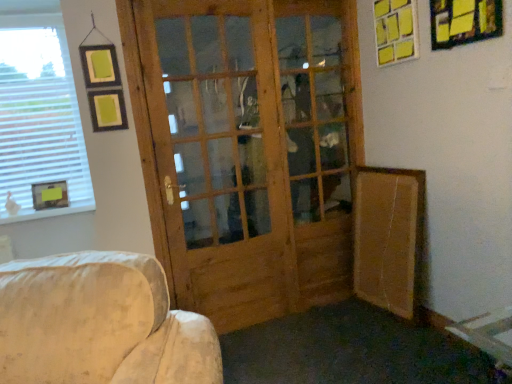
Where is `yellow paper picture frame at upper right, placed as the second picture frame when sorted from right to left`? The image size is (512, 384). yellow paper picture frame at upper right, placed as the second picture frame when sorted from right to left is located at coordinates (395, 31).

This screenshot has height=384, width=512. What do you see at coordinates (50, 195) in the screenshot?
I see `wooden picture frame at left, which ranks as the 3th picture frame in right-to-left order` at bounding box center [50, 195].

The width and height of the screenshot is (512, 384). In order to click on wooden picture frame at left, the first picture frame positioned from the bottom in this screenshot , I will do `click(50, 195)`.

Based on the photo, what is the approximate width of white blinds at left?

1.01 inches.

Where is `yellow paper picture frame at upper right, marked as the 2th picture frame in a front-to-back arrangement`? yellow paper picture frame at upper right, marked as the 2th picture frame in a front-to-back arrangement is located at coordinates (395, 31).

From the image's perspective, is yellow paper picture frame at upper right, acting as the second picture frame starting from the back, positioned above or below brown cardboard at lower right?

yellow paper picture frame at upper right, acting as the second picture frame starting from the back, is above brown cardboard at lower right.

Based on the photo, considering the relative sizes of yellow paper picture frame at upper right, placed as the 3th picture frame when sorted from bottom to top, and brown cardboard at lower right in the image provided, is yellow paper picture frame at upper right, placed as the 3th picture frame when sorted from bottom to top, shorter than brown cardboard at lower right?

Indeed, yellow paper picture frame at upper right, placed as the 3th picture frame when sorted from bottom to top, has a lesser height compared to brown cardboard at lower right.

From the image's perspective, would you say natural wood screen door at center is shown under white blinds at left?

Yes, from the image's perspective, natural wood screen door at center is below white blinds at left.

Are natural wood screen door at center and white blinds at left making contact?

No, natural wood screen door at center is not making contact with white blinds at left.

From a real-world perspective, is natural wood screen door at center physically located above or below white blinds at left?

Clearly, from a real-world perspective, natural wood screen door at center is below white blinds at left.

Between point (174, 239) and point (64, 88), which one is positioned in front?

The point (174, 239) is closer to the camera.

What's the angular difference between natural wood screen door at center and wooden picture frame at left, which ranks as the 3th picture frame in right-to-left order,'s facing directions?

There is a 7.81-degree angle between the facing directions of natural wood screen door at center and wooden picture frame at left, which ranks as the 3th picture frame in right-to-left order.

From the image's perspective, is natural wood screen door at center above or below wooden picture frame at left, the first picture frame positioned from the bottom?

natural wood screen door at center is above wooden picture frame at left, the first picture frame positioned from the bottom.

Can you confirm if natural wood screen door at center is smaller than wooden picture frame at left, which appears as the 3th picture frame when viewed from the top?

No.

Looking at this image, does natural wood screen door at center appear on the left side of wooden picture frame at left, arranged as the 1th picture frame when viewed from the back?

In fact, natural wood screen door at center is to the right of wooden picture frame at left, arranged as the 1th picture frame when viewed from the back.

From a real-world perspective, is yellow paper picture frame at upper right, the 1th picture frame from the top, beneath yellow paper picture frame at upper right, the 3th picture frame viewed from the left?

Incorrect, from a real-world perspective, yellow paper picture frame at upper right, the 1th picture frame from the top, is higher than yellow paper picture frame at upper right, the 3th picture frame viewed from the left.

Locate an element on the screen. Image resolution: width=512 pixels, height=384 pixels. the 1st picture frame behind the yellow paper picture frame at upper right, positioned as the 1th picture frame in front-to-back order, starting your count from the anchor is located at coordinates (395, 31).

Is point (389, 49) positioned behind point (447, 13)?

Yes.

In the image, is wooden picture frame at left, which is the third picture frame in front-to-back order, positioned in front of or behind white blinds at left?

wooden picture frame at left, which is the third picture frame in front-to-back order, is behind white blinds at left.

From the image's perspective, is wooden picture frame at left, which ranks as the 3th picture frame in right-to-left order, on top of white blinds at left?

No, from the image's perspective, wooden picture frame at left, which ranks as the 3th picture frame in right-to-left order, is not over white blinds at left.

Would you say white blinds at left is part of wooden picture frame at left, placed as the 1th picture frame when sorted from left to right,'s contents?

No, white blinds at left is not a part of wooden picture frame at left, placed as the 1th picture frame when sorted from left to right.

Is wooden picture frame at left, which appears as the 3th picture frame when viewed from the top, taller than white blinds at left?

No.

Can you confirm if wooden picture frame at left, the first picture frame positioned from the bottom, is positioned to the left of brown cardboard at lower right?

Correct, you'll find wooden picture frame at left, the first picture frame positioned from the bottom, to the left of brown cardboard at lower right.

Which object is thinner, wooden picture frame at left, which is the third picture frame in front-to-back order, or brown cardboard at lower right?

With smaller width is wooden picture frame at left, which is the third picture frame in front-to-back order.

From a real-world perspective, is wooden picture frame at left, which is the third picture frame in front-to-back order, positioned above or below brown cardboard at lower right?

wooden picture frame at left, which is the third picture frame in front-to-back order, is situated higher than brown cardboard at lower right in the real world.

Looking at the image, does wooden picture frame at left, placed as the 1th picture frame when sorted from left to right, seem bigger or smaller compared to brown cardboard at lower right?

Considering their sizes, wooden picture frame at left, placed as the 1th picture frame when sorted from left to right, takes up less space than brown cardboard at lower right.

This screenshot has width=512, height=384. In the image, there is a yellow paper picture frame at upper right, the 3th picture frame viewed from the left. Identify the location of bulletin board below it (from the image's perspective). (388, 237).

Considering their positions, is brown cardboard at lower right located in front of or behind yellow paper picture frame at upper right, which is the 3th picture frame from back to front?

Visually, brown cardboard at lower right is located behind yellow paper picture frame at upper right, which is the 3th picture frame from back to front.

Between point (376, 203) and point (468, 40), which one is positioned behind?

The point (376, 203) is farther.

Is brown cardboard at lower right oriented away from yellow paper picture frame at upper right, which is the 3th picture frame from back to front?

No, brown cardboard at lower right is not facing away from yellow paper picture frame at upper right, which is the 3th picture frame from back to front.

Where is `the 3rd picture frame above when counting from the brown cardboard at lower right (from the image's perspective)`? The image size is (512, 384). the 3rd picture frame above when counting from the brown cardboard at lower right (from the image's perspective) is located at coordinates (395, 31).

There is a natural wood screen door at center. At what (x,y) coordinates should I click in order to perform the action: click on window above it (from a real-world perspective). Please return your answer as a coordinate pair (x, y). This screenshot has width=512, height=384. Looking at the image, I should click on (39, 111).

From the picture: From the image, which object appears to be nearer to brown cardboard at lower right, white blinds at left or yellow paper picture frame at upper right, placed as the 3th picture frame when sorted from bottom to top?

Based on the image, yellow paper picture frame at upper right, placed as the 3th picture frame when sorted from bottom to top, appears to be nearer to brown cardboard at lower right.

Looking at the image, which one is located closer to wooden picture frame at left, the first picture frame positioned from the bottom, yellow paper picture frame at upper right, which is the 3th picture frame from back to front, or yellow paper picture frame at upper right, which is the second picture frame in left-to-right order?

yellow paper picture frame at upper right, which is the second picture frame in left-to-right order, is closer to wooden picture frame at left, the first picture frame positioned from the bottom.

Based on their spatial positions, is white blinds at left or yellow paper picture frame at upper right, which is the second picture frame in left-to-right order, closer to natural wood screen door at center?

white blinds at left lies closer to natural wood screen door at center than the other object.

When comparing their distances from wooden picture frame at left, which appears as the 3th picture frame when viewed from the top, does natural wood screen door at center or yellow paper picture frame at upper right, which is the 3th picture frame from back to front, seem closer?

Among the two, natural wood screen door at center is located nearer to wooden picture frame at left, which appears as the 3th picture frame when viewed from the top.

When comparing their distances from wooden picture frame at left, arranged as the 1th picture frame when viewed from the back, does white blinds at left or natural wood screen door at center seem closer?

white blinds at left lies closer to wooden picture frame at left, arranged as the 1th picture frame when viewed from the back, than the other object.

Considering their positions, is natural wood screen door at center positioned closer to white blinds at left than wooden picture frame at left, which appears as the 3th picture frame when viewed from the top?

wooden picture frame at left, which appears as the 3th picture frame when viewed from the top, lies closer to white blinds at left than the other object.

Considering their positions, is white blinds at left positioned further to yellow paper picture frame at upper right, which is the 3th picture frame from back to front, than yellow paper picture frame at upper right, which is the second picture frame in left-to-right order?

Based on the image, white blinds at left appears to be further to yellow paper picture frame at upper right, which is the 3th picture frame from back to front.

Estimate the real-world distances between objects in this image. Which object is further from wooden picture frame at left, which ranks as the 3th picture frame in right-to-left order, brown cardboard at lower right or white blinds at left?

brown cardboard at lower right is further to wooden picture frame at left, which ranks as the 3th picture frame in right-to-left order.

Locate an element on the screen. The width and height of the screenshot is (512, 384). screen door located between white blinds at left and yellow paper picture frame at upper right, placed as the 1th picture frame when sorted from right to left, in the left-right direction is located at coordinates (221, 157).

At what (x,y) coordinates should I click in order to perform the action: click on screen door between yellow paper picture frame at upper right, placed as the 3th picture frame when sorted from bottom to top, and brown cardboard at lower right from top to bottom. Please return your answer as a coordinate pair (x, y). The width and height of the screenshot is (512, 384). Looking at the image, I should click on 221,157.

In order to click on screen door located between wooden picture frame at left, which is the third picture frame in front-to-back order, and yellow paper picture frame at upper right, placed as the 3th picture frame when sorted from bottom to top, in the left-right direction in this screenshot , I will do `click(221, 157)`.

The width and height of the screenshot is (512, 384). I want to click on bulletin board between white blinds at left and yellow paper picture frame at upper right, positioned as the 1th picture frame in front-to-back order, in the horizontal direction, so click(388, 237).